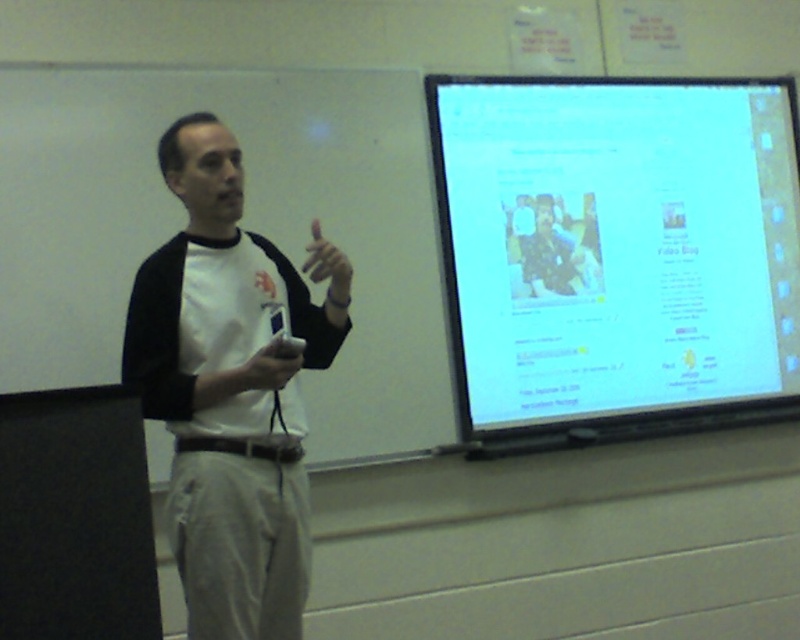
Question: Which object is positioned farthest from the white matte game controller at center?

Choices:
 (A) white matte shirt at center
 (B) matte white remote at center

Answer: (A)

Question: Which of these objects is positioned farthest from the white glossy screen at upper right?

Choices:
 (A) matte white remote at center
 (B) white matte game controller at center

Answer: (A)

Question: Can you confirm if white glossy screen at upper right is thinner than matte white remote at center?

Choices:
 (A) no
 (B) yes

Answer: (A)

Question: Is white glossy screen at upper right to the left of white matte shirt at center from the viewer's perspective?

Choices:
 (A) yes
 (B) no

Answer: (B)

Question: Is white glossy screen at upper right positioned at the back of white matte shirt at center?

Choices:
 (A) yes
 (B) no

Answer: (A)

Question: Which object appears closest to the camera in this image?

Choices:
 (A) matte white remote at center
 (B) white matte shirt at center

Answer: (B)